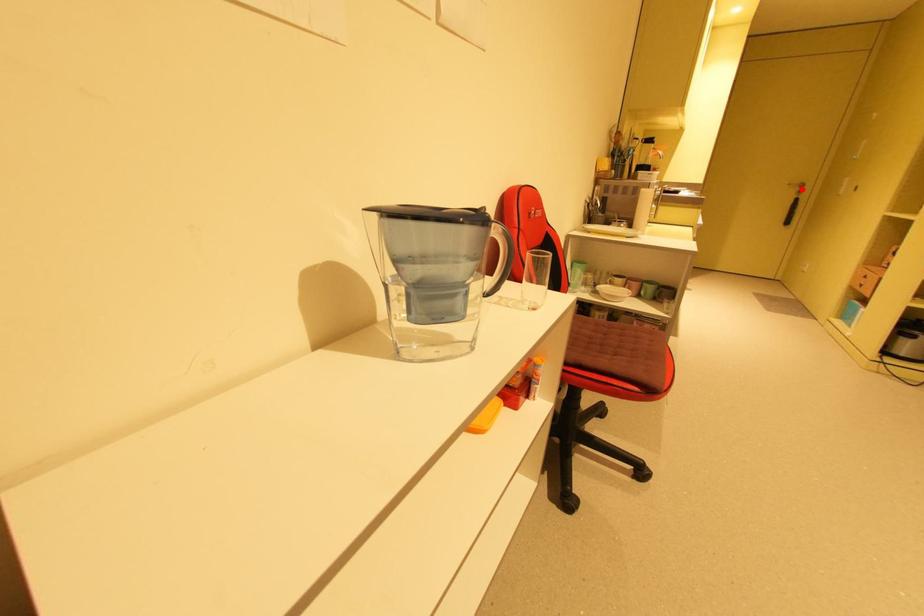
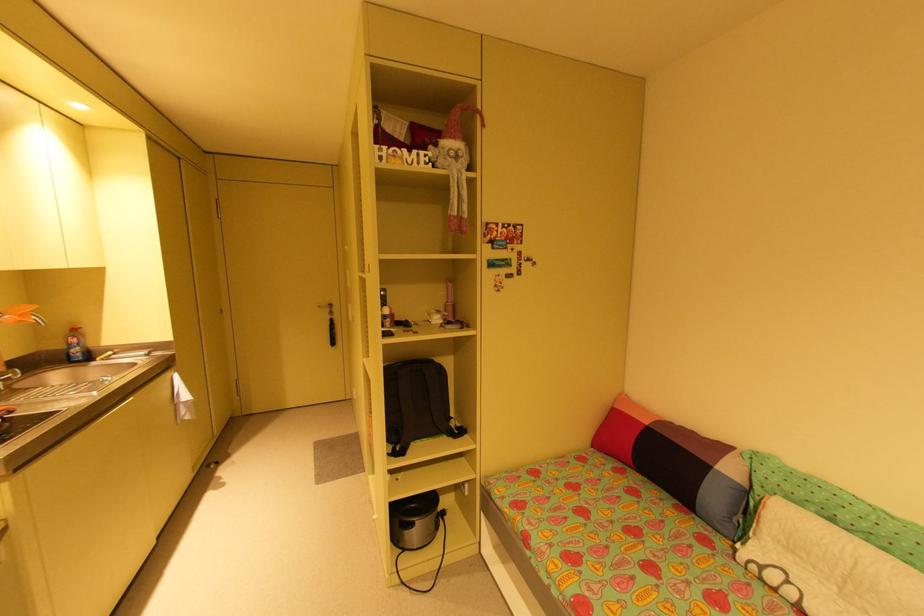
The point at the highlighted location is marked in the first image. Where is the corresponding point in the second image?

(333, 310)